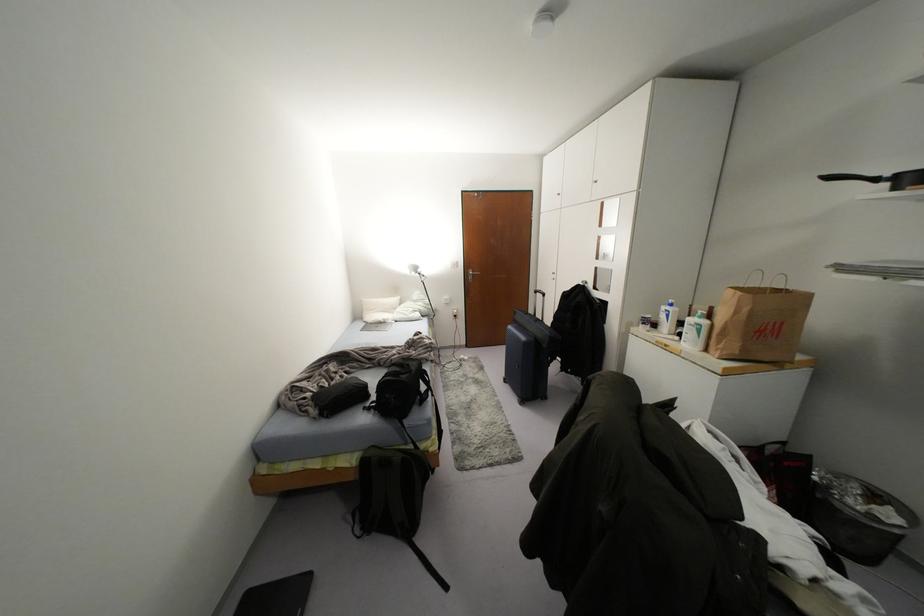
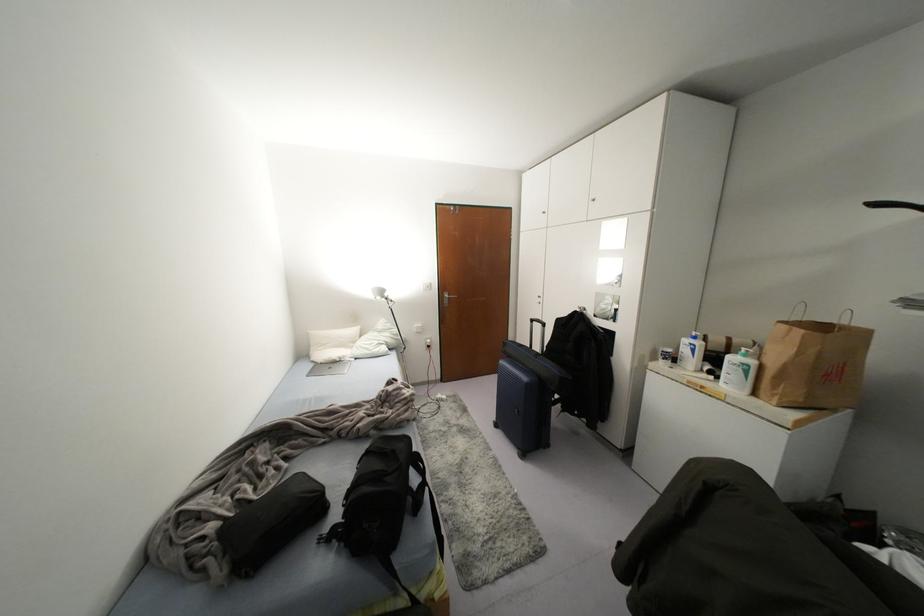
The point at (394, 299) is marked in the first image. Where is the corresponding point in the second image?

(354, 330)